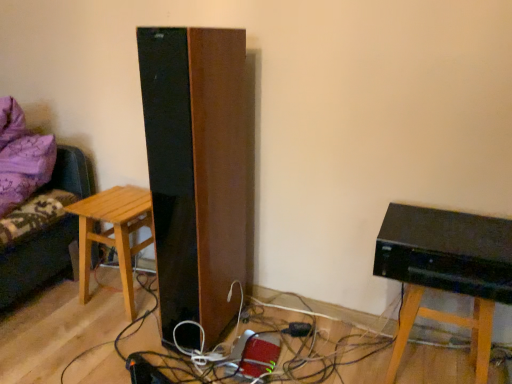
Locate an element on the screen. vacant region to the right of black plastic plug at lower center is located at coordinates (336, 335).